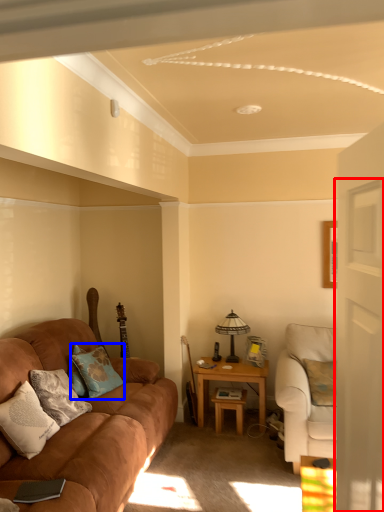
Question: Which point is closer to the camera, glass door (highlighted by a red box) or pillow (highlighted by a blue box)?

Choices:
 (A) glass door
 (B) pillow

Answer: (A)